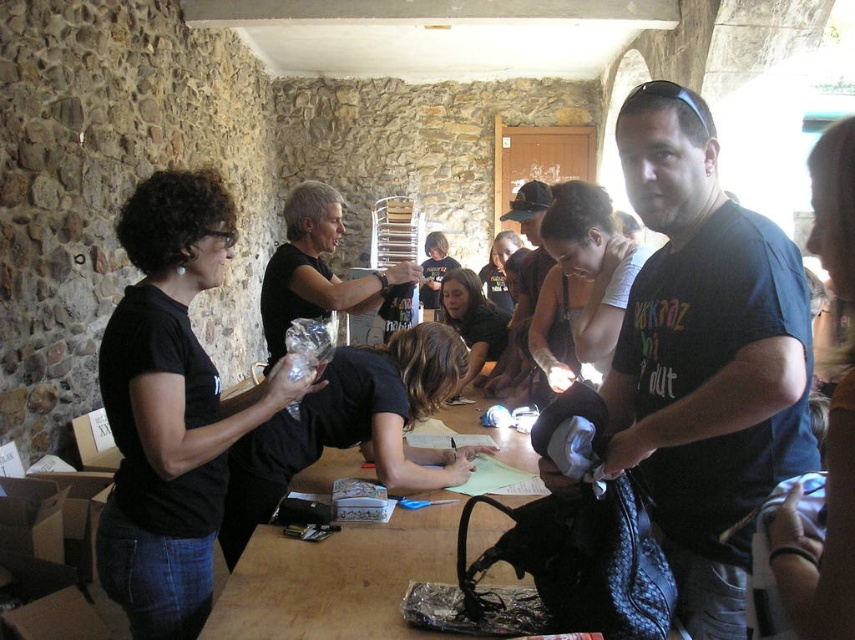
Between wooden table at center and black matte shirt at center, which one appears on the right side from the viewer's perspective?

Positioned to the right is wooden table at center.

Consider the image. Who is more forward, [327,454] or [276,332]?

Point [327,454] is more forward.

The width and height of the screenshot is (855, 640). Find the location of `wooden table at center`. wooden table at center is located at coordinates (335, 580).

Between black matte shirt at left and wooden table at center, which one is positioned lower?

wooden table at center

Does black matte shirt at left appear over wooden table at center?

Yes, black matte shirt at left is above wooden table at center.

Does point (183, 275) come farther from viewer compared to point (475, 554)?

That is False.

At what (x,y) coordinates should I click in order to perform the action: click on black matte shirt at left. Please return your answer as a coordinate pair (x, y). The height and width of the screenshot is (640, 855). Looking at the image, I should click on (171, 406).

Does point (738, 248) lie behind point (272, 362)?

No, it is not.

Is black matte t-shirt at center further to camera compared to black matte shirt at center?

No, it is in front of black matte shirt at center.

The image size is (855, 640). Find the location of `black matte t-shirt at center`. black matte t-shirt at center is located at coordinates (705, 356).